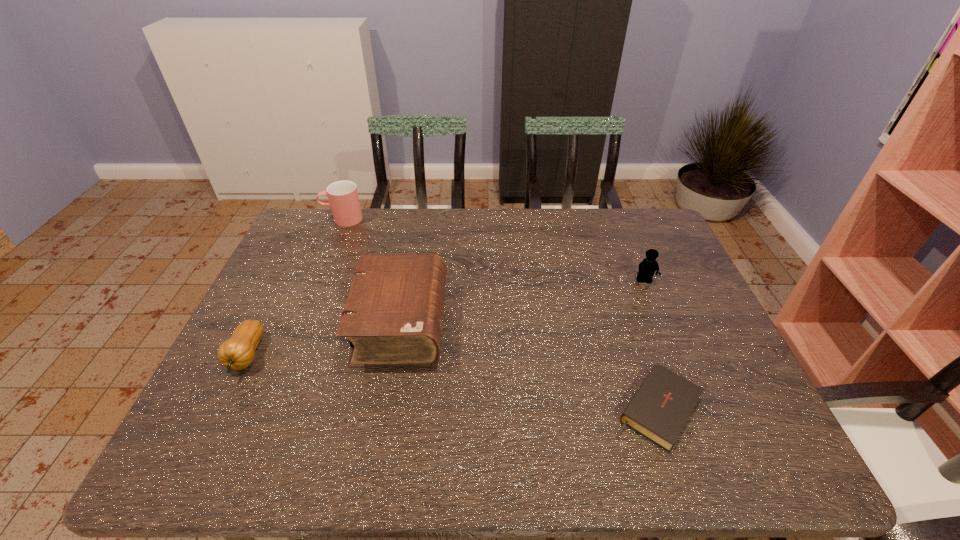
Find the location of a particular element. This screenshot has height=540, width=960. vacant region at the left edge of the desktop is located at coordinates (291, 330).

Where is `vacant space at the right edge of the desktop`? The width and height of the screenshot is (960, 540). vacant space at the right edge of the desktop is located at coordinates (750, 395).

This screenshot has height=540, width=960. I want to click on vacant space at the far left corner of the desktop, so click(310, 228).

Image resolution: width=960 pixels, height=540 pixels. In order to click on vacant region at the near left corner of the desktop in this screenshot , I will do `click(180, 451)`.

The width and height of the screenshot is (960, 540). In order to click on vacant point located between the fourth tallest object and the right Bible in this screenshot , I will do `click(451, 382)`.

The width and height of the screenshot is (960, 540). In order to click on blank region between the Lego and the cup in this screenshot , I will do `click(493, 250)`.

Find the location of a particular element. The image size is (960, 540). empty location between the third object from right to left and the fourth tallest object is located at coordinates (324, 339).

The width and height of the screenshot is (960, 540). In order to click on vacant space that is in between the left Bible and the second shortest object in this screenshot , I will do (x=324, y=339).

You are a GUI agent. You are given a task and a screenshot of the screen. Output one action in this format:
    pyautogui.click(x=<x>, y=<y>)
    Task: Click on the empty space that is in between the third object from right to left and the fourth tallest object
    The image size is (960, 540).
    Given the screenshot: What is the action you would take?
    pyautogui.click(x=324, y=339)

I want to click on empty space between the left Bible and the second shortest object, so click(324, 339).